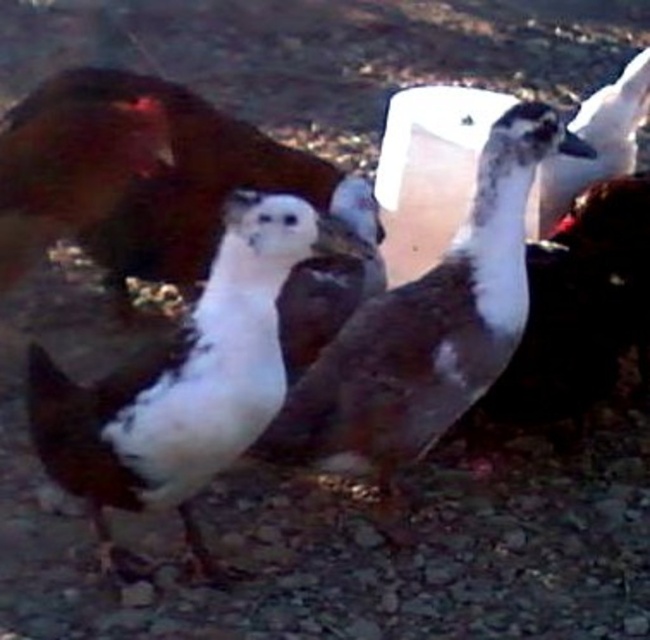
Based on the photo, who is taller, white matte duck at center or brown matte duck at center?

brown matte duck at center

Does white matte duck at center have a smaller size compared to brown matte duck at center?

No, white matte duck at center is not smaller than brown matte duck at center.

Describe the element at coordinates (185, 380) in the screenshot. This screenshot has width=650, height=640. I see `white matte duck at center` at that location.

At what (x,y) coordinates should I click in order to perform the action: click on white matte duck at center. Please return your answer as a coordinate pair (x, y). This screenshot has height=640, width=650. Looking at the image, I should click on (185, 380).